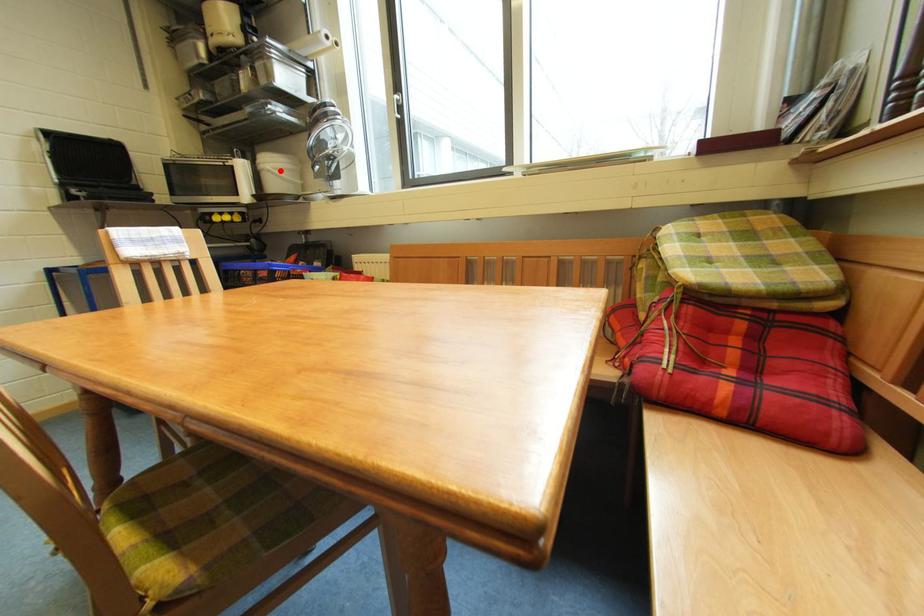
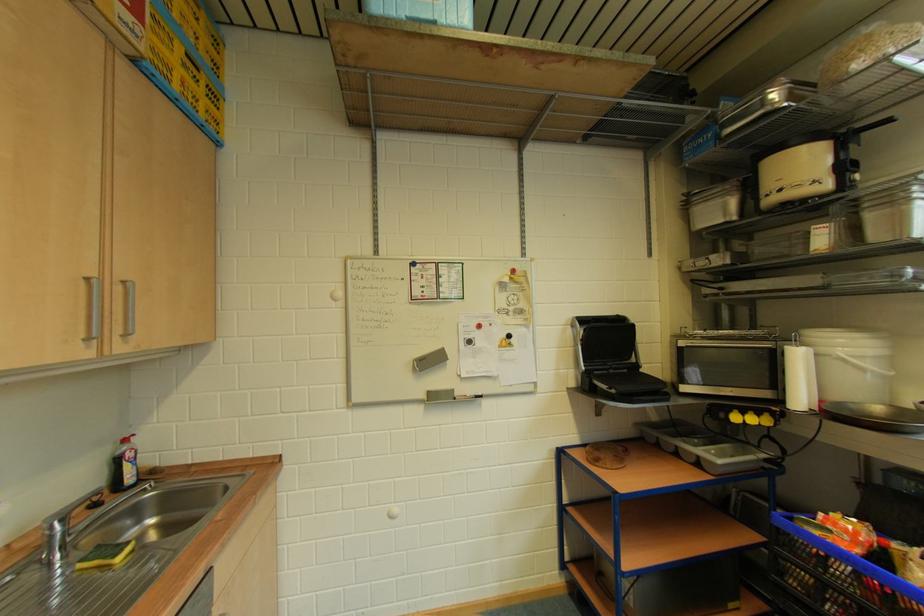
The point at the highlighted location is marked in the first image. Where is the corresponding point in the second image?

(858, 360)